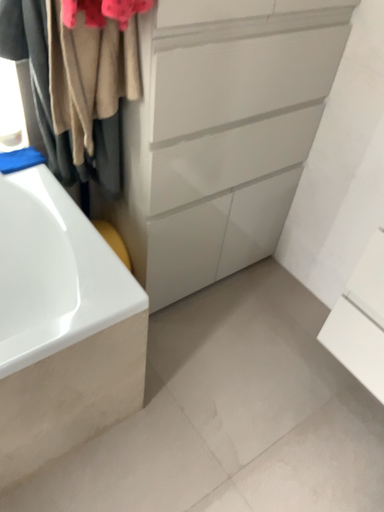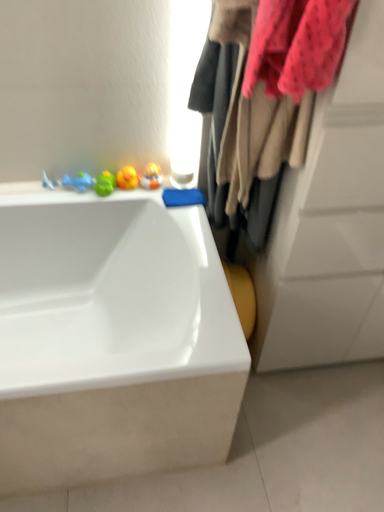
Question: How did the camera likely rotate when shooting the video?

Choices:
 (A) rotated right
 (B) rotated left

Answer: (B)